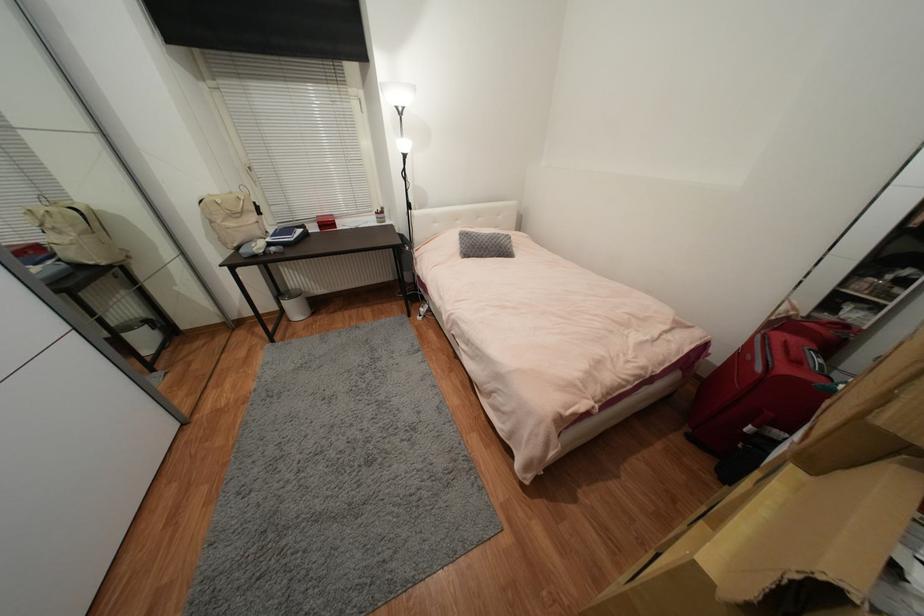
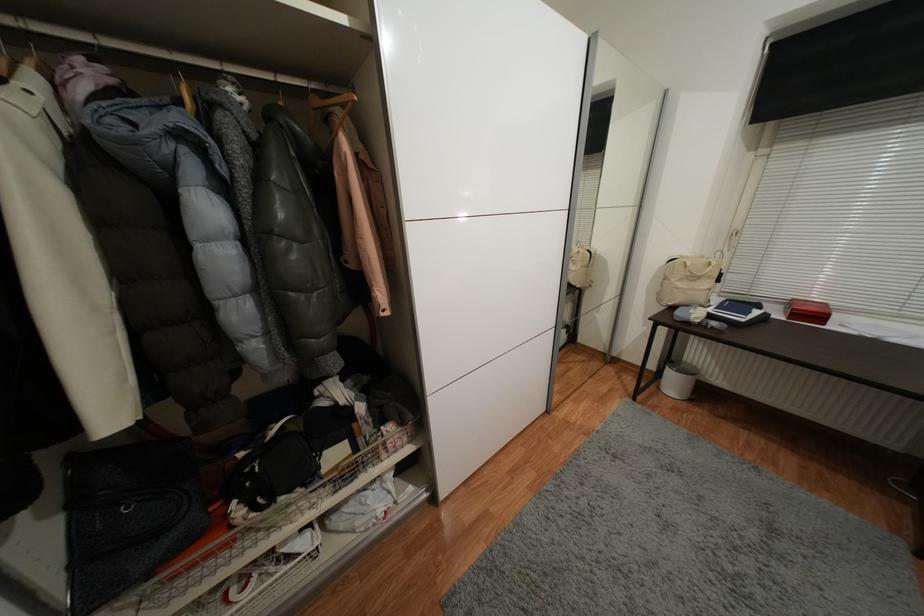
Find the pixel in the second image that matches (x=336, y=225) in the first image.

(824, 318)